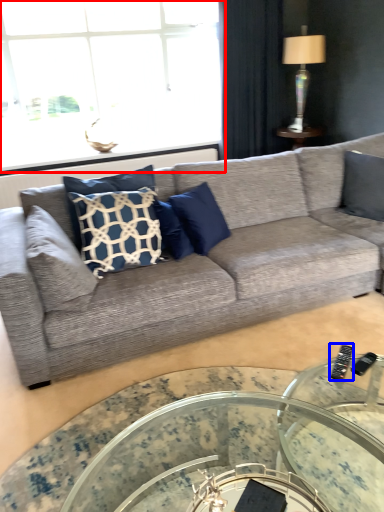
Question: Which object is closer to the camera taking this photo, window (highlighted by a red box) or remote (highlighted by a blue box)?

Choices:
 (A) window
 (B) remote

Answer: (B)